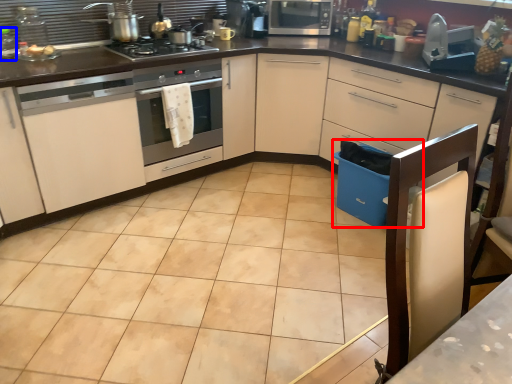
Question: Which point is further to the camera, dish washer (highlighted by a red box) or appliance (highlighted by a blue box)?

Choices:
 (A) dish washer
 (B) appliance

Answer: (A)